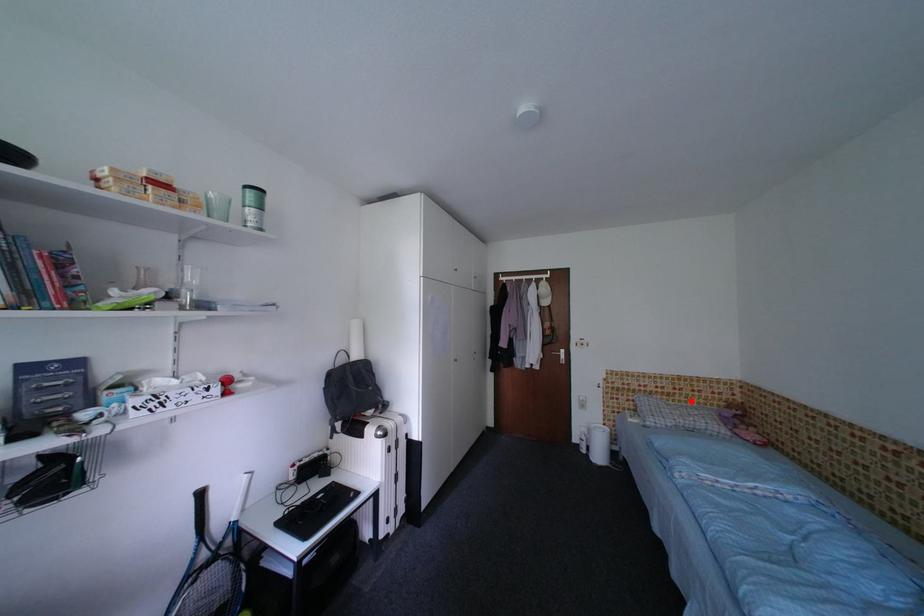
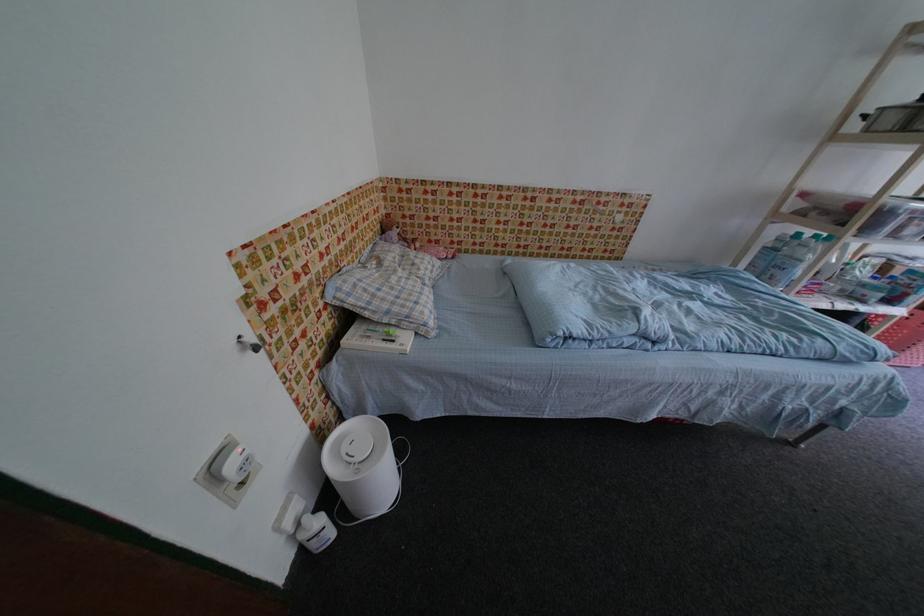
Where in the second image is the point corresponding to the highlighted location from the first image?

(370, 246)